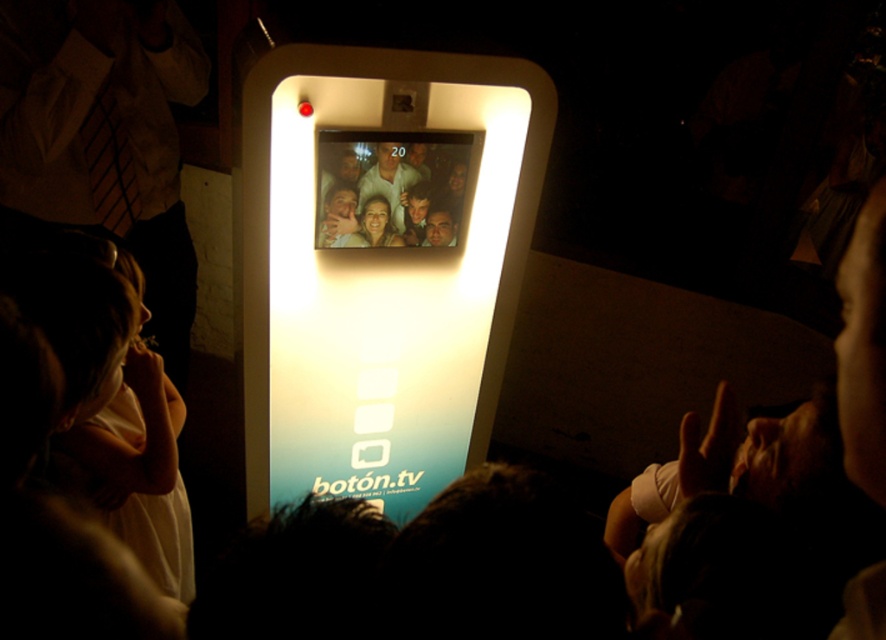
Question: Is light pink fabric at left positioned before matte white face at center?

Choices:
 (A) yes
 (B) no

Answer: (A)

Question: Among these points, which one is nearest to the camera?

Choices:
 (A) (92, 93)
 (B) (169, 444)
 (C) (379, 218)

Answer: (B)

Question: Can you confirm if matte white phone at left is positioned above light pink fabric at left?

Choices:
 (A) no
 (B) yes

Answer: (B)

Question: Does light pink fabric at left have a smaller size compared to matte white face at center?

Choices:
 (A) no
 (B) yes

Answer: (A)

Question: Which of the following is the closest to the observer?

Choices:
 (A) (144, 112)
 (B) (382, 205)
 (C) (140, 307)

Answer: (C)

Question: Which object is farther from the camera taking this photo?

Choices:
 (A) matte white face at center
 (B) matte white phone at left

Answer: (B)